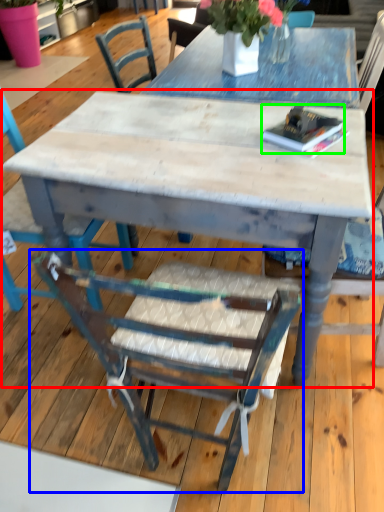
Question: Estimate the real-world distances between objects in this image. Which object is farther from kitchen & dining room table (highlighted by a red box), chair (highlighted by a blue box) or book (highlighted by a green box)?

Choices:
 (A) chair
 (B) book

Answer: (A)